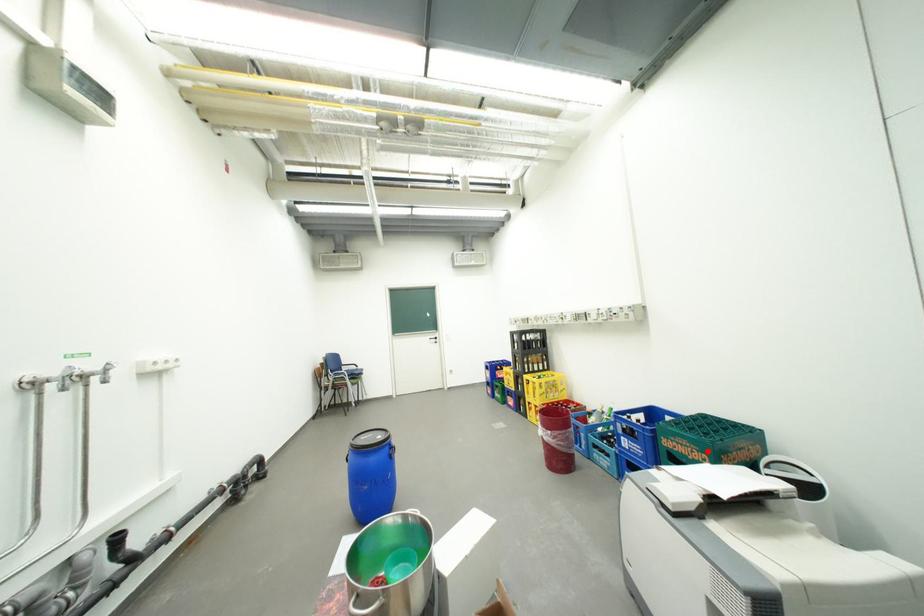
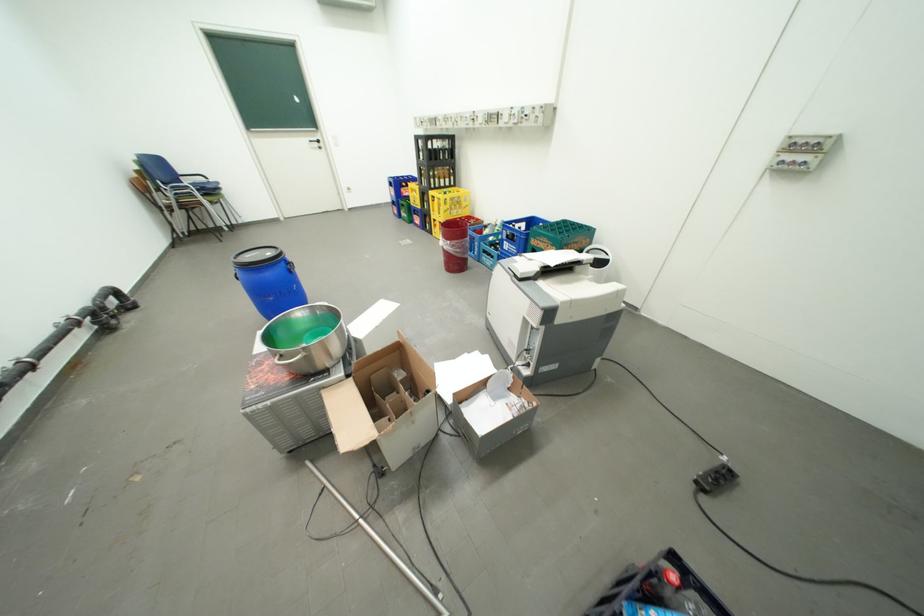
Locate, in the second image, the point that corresponds to the highlighted location in the first image.

(562, 246)